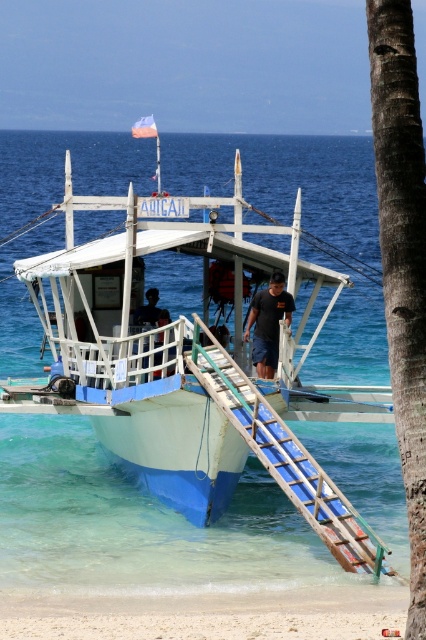
Question: Estimate the real-world distances between objects in this image. Which object is closer to the white sand beach at lower left?

Choices:
 (A) dark blue shorts at center
 (B) blue plastic ladder at lower center
 (C) smooth brown trunk of palm tree at center right
 (D) white wooden boat at center

Answer: (B)

Question: Which of the following is the closest to the observer?

Choices:
 (A) blue plastic ladder at lower center
 (B) white sand beach at lower left

Answer: (B)

Question: Which of these objects is positioned closest to the smooth brown trunk of palm tree at center right?

Choices:
 (A) white wooden boat at center
 (B) dark blue shorts at center

Answer: (B)

Question: Is blue plastic ladder at lower center bigger than dark blue shorts at center?

Choices:
 (A) yes
 (B) no

Answer: (A)

Question: Can you confirm if white sand beach at lower left is positioned to the right of dark blue shorts at center?

Choices:
 (A) yes
 (B) no

Answer: (B)

Question: Observing the image, what is the correct spatial positioning of white wooden boat at center in reference to dark blue shorts at center?

Choices:
 (A) below
 (B) above

Answer: (B)